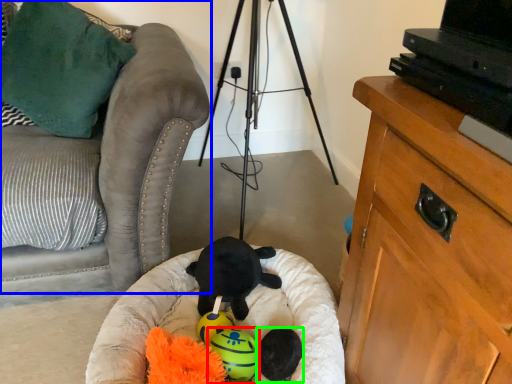
Question: Considering the real-world distances, which object is closest to toy (highlighted by a red box)? furniture (highlighted by a blue box) or toy (highlighted by a green box).

Choices:
 (A) furniture
 (B) toy

Answer: (B)